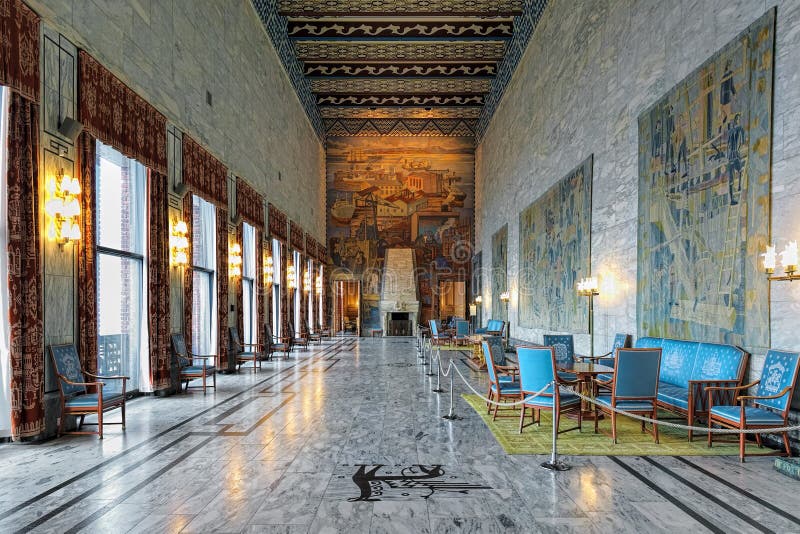
The width and height of the screenshot is (800, 534). I want to click on tapestry hanging on the wall, so click(666, 290), click(550, 254), click(489, 256).